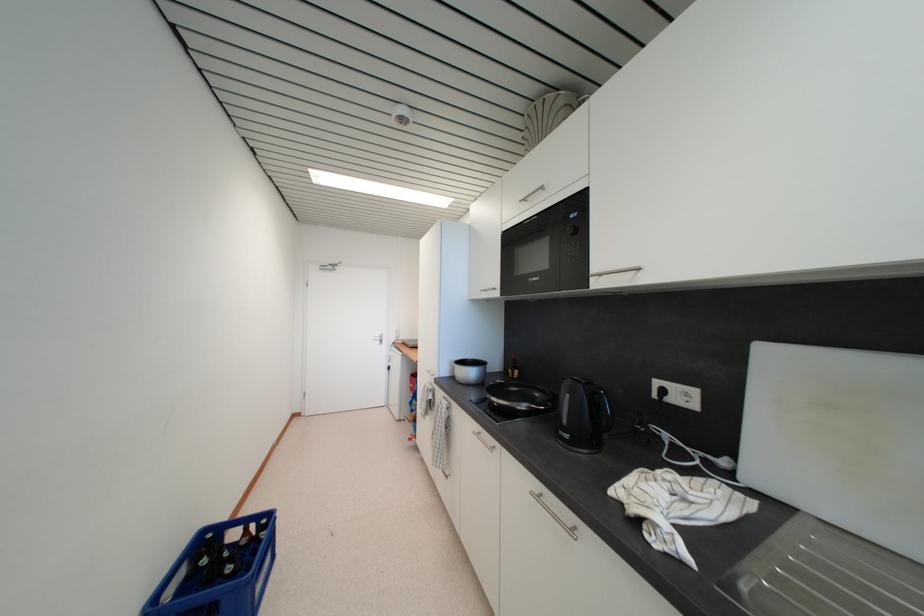
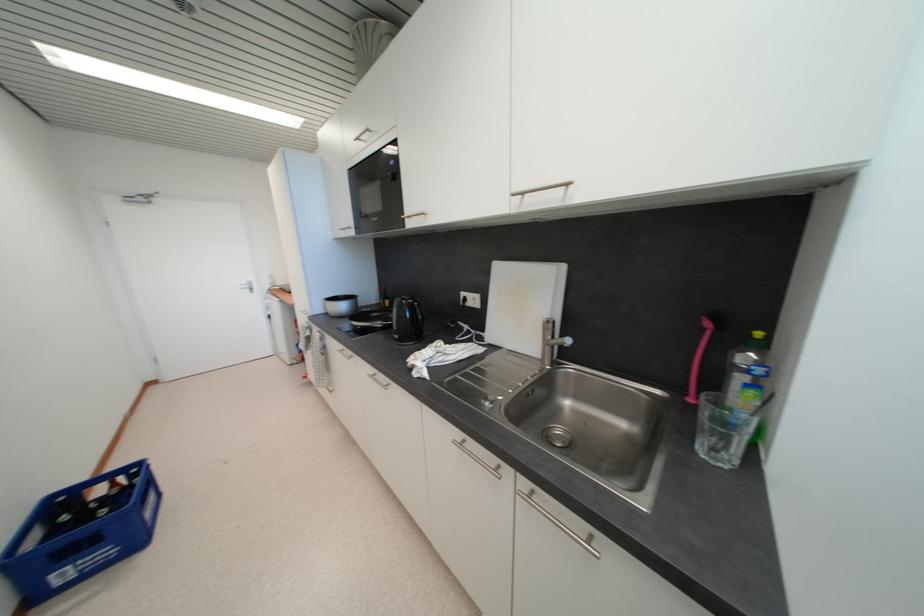
In the second image, find the point that corresponds to the point at 251,533 in the first image.

(118, 487)